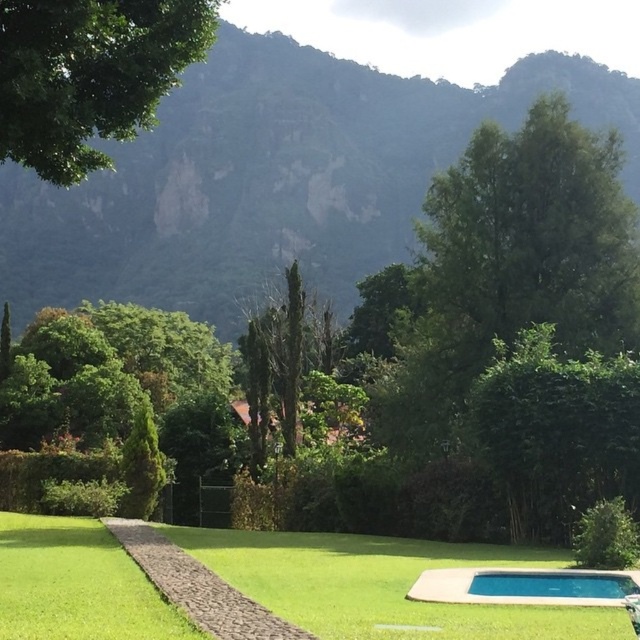
The image size is (640, 640). I want to click on green leafy tree at upper left, so click(90, 74).

Who is taller, green leafy tree at upper left or blue smooth pool at lower right?

green leafy tree at upper left is taller.

Where is `green leafy tree at upper left`? green leafy tree at upper left is located at coordinates (90, 74).

This screenshot has height=640, width=640. What are the coordinates of `green leafy tree at upper left` in the screenshot? It's located at (90, 74).

Is point (484, 376) farther from viewer compared to point (506, 586)?

That is True.

Is green leafy bush at center closer to camera compared to blue smooth pool at lower right?

No, it is behind blue smooth pool at lower right.

Describe the element at coordinates (556, 433) in the screenshot. I see `green leafy bush at center` at that location.

Where is `green leafy bush at center`? green leafy bush at center is located at coordinates (556, 433).

Find the location of a particular element. Image resolution: width=640 pixels, height=640 pixels. green rocky mountain at upper center is located at coordinates (272, 179).

Between green rocky mountain at upper center and green leafy tree at upper left, which one is positioned higher?

green rocky mountain at upper center

The width and height of the screenshot is (640, 640). I want to click on green rocky mountain at upper center, so click(272, 179).

The image size is (640, 640). Find the location of `green rocky mountain at upper center`. green rocky mountain at upper center is located at coordinates 272,179.